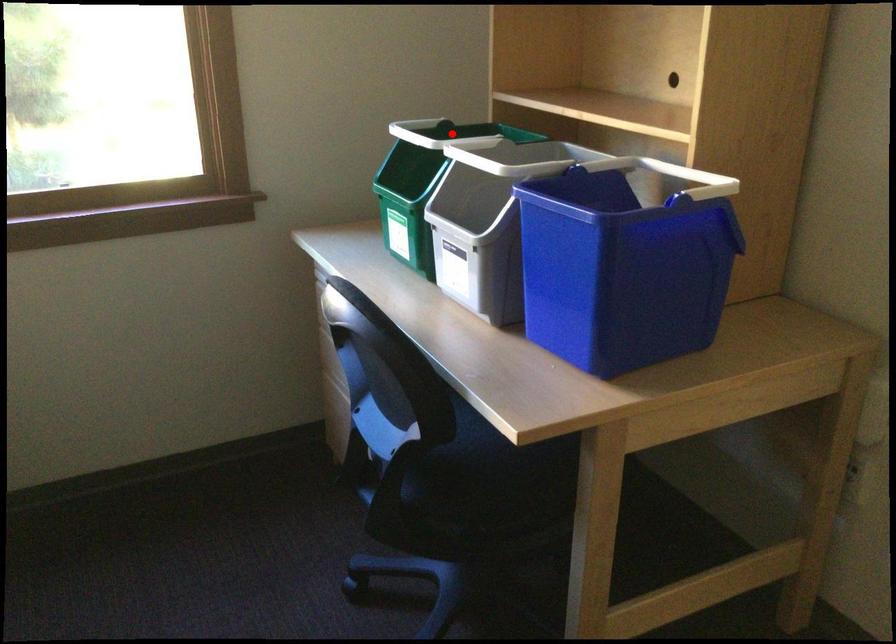
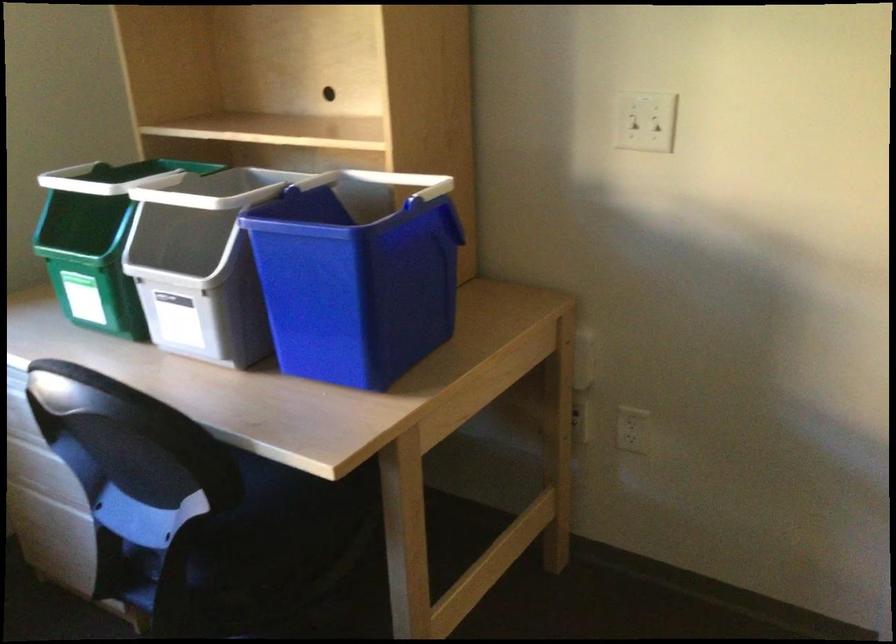
Locate, in the second image, the point that corresponds to the highlighted location in the first image.

(116, 178)